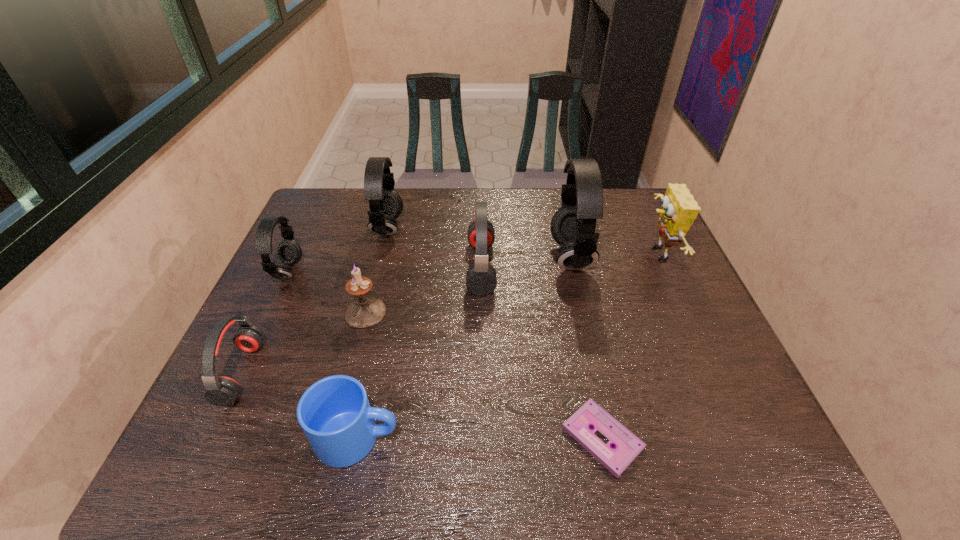
Where is `vacant space located 0.270m on the face of the rightmost object`? vacant space located 0.270m on the face of the rightmost object is located at coordinates (552, 253).

The image size is (960, 540). Find the location of `vacant space located on the face of the rightmost object`. vacant space located on the face of the rightmost object is located at coordinates (572, 253).

Find the location of `vacant space located on the ear cups of the farther red earphone`. vacant space located on the ear cups of the farther red earphone is located at coordinates (373, 267).

You are a GUI agent. You are given a task and a screenshot of the screen. Output one action in this format:
    pyautogui.click(x=<x>, y=<y>)
    Task: Click on the free space located on the ear cups of the farther red earphone
    The height and width of the screenshot is (540, 960).
    Given the screenshot: What is the action you would take?
    pyautogui.click(x=422, y=267)

Locate an element on the screen. The width and height of the screenshot is (960, 540). vacant space located on the ear cups of the farther red earphone is located at coordinates (371, 267).

Where is `blank area located 0.180m on the ear cups of the smallest black earphone`? Image resolution: width=960 pixels, height=540 pixels. blank area located 0.180m on the ear cups of the smallest black earphone is located at coordinates (363, 273).

Where is `free space located 0.160m on the front of the sixth farthest object`? The width and height of the screenshot is (960, 540). free space located 0.160m on the front of the sixth farthest object is located at coordinates (348, 383).

Locate an element on the screen. The image size is (960, 540). vacant position located on the ear cups of the shortest earphone is located at coordinates (281, 373).

What are the coordinates of `vacant space located on the side of the mug with the handle` in the screenshot? It's located at (474, 438).

Locate an element on the screen. vacant space positioned 0.330m on the left of the shortest object is located at coordinates (400, 438).